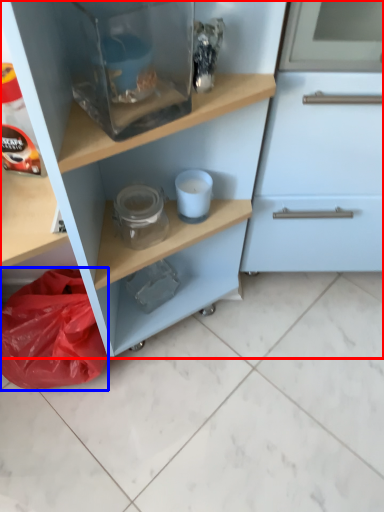
Question: Which object appears closest to the camera in this image, cupboard (highlighted by a red box) or material (highlighted by a blue box)?

Choices:
 (A) cupboard
 (B) material

Answer: (A)